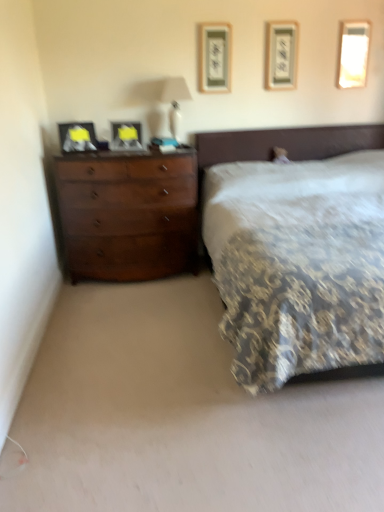
Question: Is patterned fabric bed at center taller than metallic silver picture frame at upper center, the 2th picture frame when ordered from right to left?

Choices:
 (A) no
 (B) yes

Answer: (B)

Question: Can you confirm if patterned fabric bed at center is thinner than metallic silver picture frame at upper center, which is the fourth picture frame from left to right?

Choices:
 (A) yes
 (B) no

Answer: (B)

Question: Is patterned fabric bed at center next to metallic silver picture frame at upper center, the 2th picture frame when ordered from right to left?

Choices:
 (A) no
 (B) yes

Answer: (A)

Question: Is patterned fabric bed at center at the left side of metallic silver picture frame at upper center, the 2th picture frame when ordered from right to left?

Choices:
 (A) yes
 (B) no

Answer: (B)

Question: From the image's perspective, does patterned fabric bed at center appear higher than metallic silver picture frame at upper center, the 2th picture frame when ordered from right to left?

Choices:
 (A) no
 (B) yes

Answer: (A)

Question: Is point (137, 145) positioned closer to the camera than point (276, 30)?

Choices:
 (A) closer
 (B) farther

Answer: (A)

Question: From the image's perspective, is matte black picture frame at center, marked as the second picture frame in a left-to-right arrangement, above or below metallic silver picture frame at upper center, which is the fourth picture frame from left to right?

Choices:
 (A) above
 (B) below

Answer: (B)

Question: From a real-world perspective, is matte black picture frame at center, positioned as the fourth picture frame in right-to-left order, physically located above or below metallic silver picture frame at upper center, the 2th picture frame when ordered from right to left?

Choices:
 (A) below
 (B) above

Answer: (A)

Question: Do you think matte black picture frame at center, positioned as the fourth picture frame in right-to-left order, is within metallic silver picture frame at upper center, the 2th picture frame when ordered from right to left, or outside of it?

Choices:
 (A) outside
 (B) inside

Answer: (A)

Question: Is matte black picture frame at left, placed as the 5th picture frame when sorted from right to left, taller or shorter than matte wood picture frame at upper center, acting as the 3th picture frame starting from the right?

Choices:
 (A) tall
 (B) short

Answer: (B)

Question: Is point [82, 123] positioned closer to the camera than point [218, 42]?

Choices:
 (A) farther
 (B) closer

Answer: (B)

Question: From the image's perspective, relative to matte wood picture frame at upper center, acting as the 3th picture frame starting from the right, is matte black picture frame at left, placed as the 5th picture frame when sorted from right to left, above or below?

Choices:
 (A) above
 (B) below

Answer: (B)

Question: Is matte black picture frame at left, placed as the 5th picture frame when sorted from right to left, inside the boundaries of matte wood picture frame at upper center, arranged as the third picture frame when viewed from the left, or outside?

Choices:
 (A) inside
 (B) outside

Answer: (B)

Question: Does point (269, 57) appear closer or farther from the camera than point (140, 138)?

Choices:
 (A) farther
 (B) closer

Answer: (B)

Question: In terms of width, does metallic silver picture frame at upper center, which is the fourth picture frame from left to right, look wider or thinner when compared to matte black picture frame at center, positioned as the fourth picture frame in right-to-left order?

Choices:
 (A) thin
 (B) wide

Answer: (A)